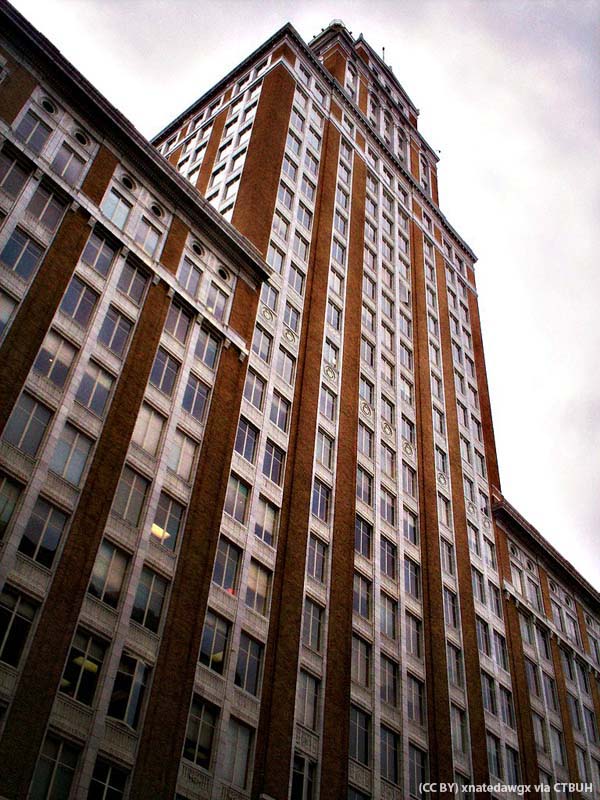
What are the coordinates of `window with closed curtain` in the screenshot? It's located at (238, 761).